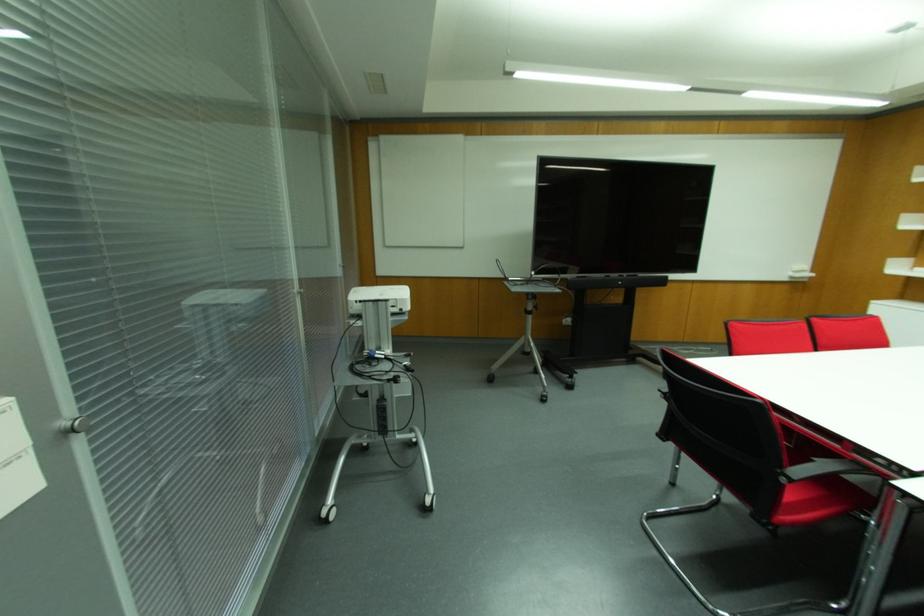
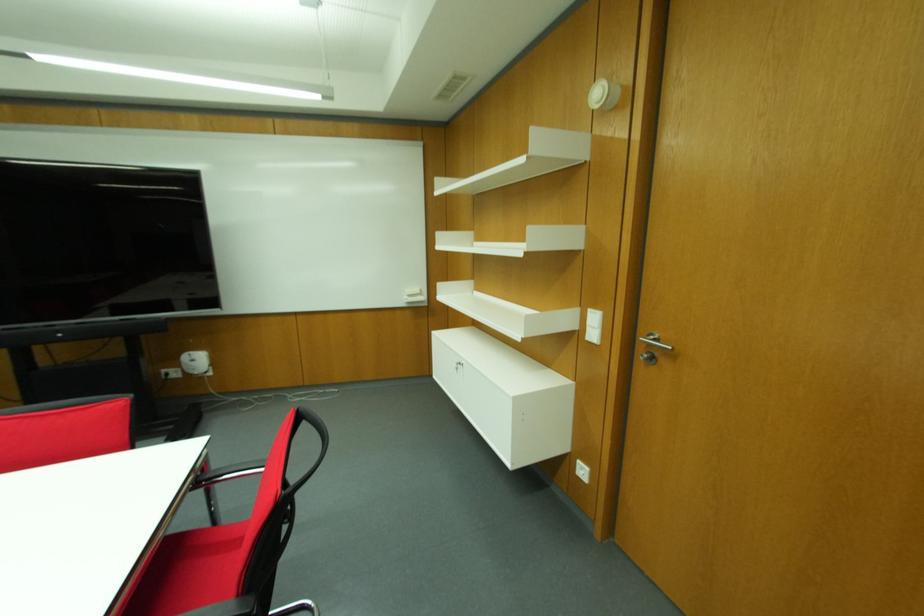
Question: In a continuous first-person perspective shot, in which direction is the camera moving?

Choices:
 (A) Left
 (B) Right
 (C) Forward
 (D) Backward

Answer: (B)